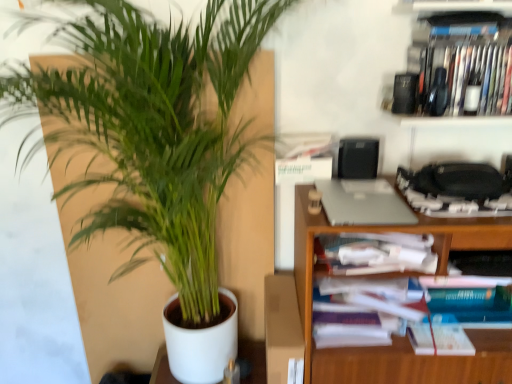
This screenshot has width=512, height=384. In order to click on white paper book at center right in this screenshot , I will do `click(407, 311)`.

Describe the element at coordinates (358, 158) in the screenshot. I see `black plastic speaker at upper right` at that location.

You are a GUI agent. You are given a task and a screenshot of the screen. Output one action in this format:
    pyautogui.click(x=<x>, y=<y>)
    Task: Click on the green leafy plant at left
    
    Given the screenshot: What is the action you would take?
    pyautogui.click(x=155, y=128)

Measure the distance between metallic silver cabinet at upper right and camera.

They are 1.19 meters apart.

What do you see at coordinates (362, 203) in the screenshot? I see `silver metallic laptop at upper right` at bounding box center [362, 203].

Image resolution: width=512 pixels, height=384 pixels. I want to click on white paper book at center right, so pyautogui.click(x=407, y=311).

Is point (430, 114) closer or farther from the camera than point (493, 289)?

Point (430, 114) is closer to the camera than point (493, 289).

This screenshot has width=512, height=384. What are the coordinates of `book located on the left of metallic silver cabinet at upper right` in the screenshot? It's located at (407, 311).

Is metallic silver cabinet at upper right taller than white paper book at center right?

Incorrect, the height of metallic silver cabinet at upper right is not larger of that of white paper book at center right.

How many degrees apart are the facing directions of metallic silver cabinet at upper right and white paper book at center right?

The facing directions of metallic silver cabinet at upper right and white paper book at center right are 3.24 degrees apart.

How distant is black plastic speaker at upper right from metallic silver cabinet at upper right?

black plastic speaker at upper right and metallic silver cabinet at upper right are 12.90 inches apart.

Does point (355, 168) come behind point (481, 30)?

Yes, it is behind point (481, 30).

At what (x,y) coordinates should I click in order to perform the action: click on cabinet in front of the black plastic speaker at upper right. Please return your answer as a coordinate pair (x, y). The height and width of the screenshot is (384, 512). Looking at the image, I should click on (461, 61).

Is silver metallic laptop at upper right looking in the opposite direction of white paper book at center right?

silver metallic laptop at upper right does not have its back to white paper book at center right.

How many degrees apart are the facing directions of silver metallic laptop at upper right and white paper book at center right?

Result: The angular difference between silver metallic laptop at upper right and white paper book at center right is 0.285 degrees.

From the image's perspective, relative to white paper book at center right, is silver metallic laptop at upper right above or below?

silver metallic laptop at upper right is above white paper book at center right.

Where is `laptop that is on the left side of white paper book at center right`? laptop that is on the left side of white paper book at center right is located at coordinates (362, 203).

Could you tell me if metallic silver cabinet at upper right is facing black plastic speaker at upper right?

No, metallic silver cabinet at upper right does not turn towards black plastic speaker at upper right.

Are metallic silver cabinet at upper right and black plastic speaker at upper right making contact?

No, metallic silver cabinet at upper right is not in contact with black plastic speaker at upper right.

Which is more to the right, metallic silver cabinet at upper right or black plastic speaker at upper right?

Positioned to the right is metallic silver cabinet at upper right.

Can you confirm if metallic silver cabinet at upper right is thinner than black plastic speaker at upper right?

In fact, metallic silver cabinet at upper right might be wider than black plastic speaker at upper right.

Locate an element on the screen. book that appears below the black plastic speaker at upper right (from the image's perspective) is located at coordinates (407, 311).

Is white paper book at center right wider than black plastic speaker at upper right?

Yes, white paper book at center right is wider than black plastic speaker at upper right.

From the image's perspective, is white paper book at center right located above black plastic speaker at upper right?

No, from the image's perspective, white paper book at center right is not on top of black plastic speaker at upper right.

How different are the orientations of white paper book at center right and black plastic speaker at upper right in degrees?

→ They differ by 4.23 degrees in their facing directions.

Which is more to the right, green leafy plant at left or metallic silver cabinet at upper right?

From the viewer's perspective, metallic silver cabinet at upper right appears more on the right side.

From the picture: Considering the relative sizes of green leafy plant at left and metallic silver cabinet at upper right in the image provided, is green leafy plant at left thinner than metallic silver cabinet at upper right?

Yes, green leafy plant at left is thinner than metallic silver cabinet at upper right.

Between point (201, 63) and point (395, 101), which one is positioned behind?

The point (395, 101) is farther.

Is green leafy plant at left located outside metallic silver cabinet at upper right?

Indeed, green leafy plant at left is completely outside metallic silver cabinet at upper right.

Based on the photo, from a real-world perspective, is metallic silver cabinet at upper right positioned above or below green leafy plant at left?

Clearly, from a real-world perspective, metallic silver cabinet at upper right is above green leafy plant at left.

Considering the sizes of objects metallic silver cabinet at upper right and green leafy plant at left in the image provided, who is taller, metallic silver cabinet at upper right or green leafy plant at left?

green leafy plant at left.

Considering the positions of objects metallic silver cabinet at upper right and green leafy plant at left in the image provided, who is more to the left, metallic silver cabinet at upper right or green leafy plant at left?

green leafy plant at left is more to the left.

Locate an element on the screen. cabinet that appears above the white paper book at center right (from a real-world perspective) is located at coordinates (461, 61).

Identify the location of cabinet lying above the black plastic speaker at upper right (from the image's perspective). (461, 61).

Looking at this image, which object lies further to the anchor point metallic silver cabinet at upper right, white paper book at center right or silver metallic laptop at upper right?

white paper book at center right.

Considering their positions, is black plastic speaker at upper right positioned further to silver metallic laptop at upper right than white paper book at center right?

white paper book at center right is positioned further to the anchor silver metallic laptop at upper right.

Considering their positions, is metallic silver cabinet at upper right positioned closer to silver metallic laptop at upper right than green leafy plant at left?

Based on the image, metallic silver cabinet at upper right appears to be nearer to silver metallic laptop at upper right.

From the picture: Considering their positions, is metallic silver cabinet at upper right positioned further to black plastic speaker at upper right than white paper book at center right?

The object further to black plastic speaker at upper right is white paper book at center right.

From the image, which object appears to be nearer to green leafy plant at left, white paper book at center right or silver metallic laptop at upper right?

silver metallic laptop at upper right is positioned closer to the anchor green leafy plant at left.

Based on their spatial positions, is metallic silver cabinet at upper right or black plastic speaker at upper right closer to green leafy plant at left?

The object closer to green leafy plant at left is black plastic speaker at upper right.

Considering their positions, is white paper book at center right positioned further to green leafy plant at left than black plastic speaker at upper right?

Based on the image, black plastic speaker at upper right appears to be further to green leafy plant at left.

Which object lies nearer to the anchor point green leafy plant at left, silver metallic laptop at upper right or white paper book at center right?

silver metallic laptop at upper right lies closer to green leafy plant at left than the other object.

Find the location of `book between green leafy plant at left and metallic silver cabinet at upper right`. book between green leafy plant at left and metallic silver cabinet at upper right is located at coordinates (407, 311).

Image resolution: width=512 pixels, height=384 pixels. Identify the location of laptop between green leafy plant at left and metallic silver cabinet at upper right. (362, 203).

Locate an element on the screen. The width and height of the screenshot is (512, 384). speaker between green leafy plant at left and white paper book at center right is located at coordinates (358, 158).

Locate an element on the screen. speaker between green leafy plant at left and metallic silver cabinet at upper right in the horizontal direction is located at coordinates (358, 158).